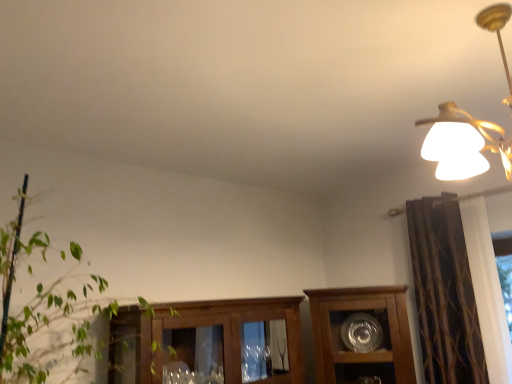
This screenshot has height=384, width=512. Find the location of `green leafy plant at left`. green leafy plant at left is located at coordinates (45, 307).

I want to click on wooden cabinet at center, so click(x=368, y=335).

What do you see at coordinates (462, 144) in the screenshot?
I see `matte gold chandelier at upper right` at bounding box center [462, 144].

Locate an element on the screen. green leafy plant at left is located at coordinates (45, 307).

Considering the relative sizes of wooden cabinet at center and matte gold chandelier at upper right in the image provided, is wooden cabinet at center thinner than matte gold chandelier at upper right?

Correct, the width of wooden cabinet at center is less than that of matte gold chandelier at upper right.

From a real-world perspective, which object stands above the other?

matte gold chandelier at upper right.

How far apart are wooden cabinet at center and matte gold chandelier at upper right?

They are 1.59 meters apart.

Is wooden cabinet at center turned away from matte gold chandelier at upper right?

No, matte gold chandelier at upper right is not at the back of wooden cabinet at center.

Which point is more forward, (434, 118) or (87, 302)?

Positioned in front is point (434, 118).

Between matte gold chandelier at upper right and green leafy plant at left, which one has smaller size?

matte gold chandelier at upper right is smaller.

Considering the relative sizes of matte gold chandelier at upper right and green leafy plant at left in the image provided, is matte gold chandelier at upper right shorter than green leafy plant at left?

Yes.

In the scene shown: From a real-world perspective, is matte gold chandelier at upper right on top of green leafy plant at left?

Yes, from a real-world perspective, matte gold chandelier at upper right is on top of green leafy plant at left.

Does point (420, 332) come farther from viewer compared to point (22, 218)?

Yes.

Considering the sizes of brown textured curtain at right and green leafy plant at left in the image, is brown textured curtain at right taller or shorter than green leafy plant at left?

brown textured curtain at right is taller than green leafy plant at left.

Consider the image. From the image's perspective, relative to green leafy plant at left, is brown textured curtain at right above or below?

Clearly, from the image's perspective, brown textured curtain at right is below green leafy plant at left.

Is brown textured curtain at right looking in the opposite direction of green leafy plant at left?

No, brown textured curtain at right is not facing away from green leafy plant at left.

From the image's perspective, is green leafy plant at left located above matte gold chandelier at upper right?

No, from the image's perspective, green leafy plant at left is not on top of matte gold chandelier at upper right.

Is green leafy plant at left not near matte gold chandelier at upper right?

Absolutely, green leafy plant at left is distant from matte gold chandelier at upper right.

Between green leafy plant at left and matte gold chandelier at upper right, which one appears on the right side from the viewer's perspective?

Positioned to the right is matte gold chandelier at upper right.

Is matte gold chandelier at upper right surrounded by green leafy plant at left?

Actually, matte gold chandelier at upper right is outside green leafy plant at left.

Between point (437, 329) and point (460, 109), which one is positioned behind?

Point (437, 329)

Considering the positions of objects brown textured curtain at right and matte gold chandelier at upper right in the image provided, who is behind, brown textured curtain at right or matte gold chandelier at upper right?

brown textured curtain at right is behind.

Are matte gold chandelier at upper right and wooden cabinet at center far apart?

matte gold chandelier at upper right is positioned a significant distance from wooden cabinet at center.

At what (x,y) coordinates should I click in order to perform the action: click on lamp that appears above the wooden cabinet at center (from the image's perspective). Please return your answer as a coordinate pair (x, y). The width and height of the screenshot is (512, 384). Looking at the image, I should click on (462, 144).

Is matte gold chandelier at upper right outside of wooden cabinet at center?

Yes, matte gold chandelier at upper right is outside of wooden cabinet at center.

From a real-world perspective, is matte gold chandelier at upper right positioned above or below wooden cabinet at center?

matte gold chandelier at upper right is situated higher than wooden cabinet at center in the real world.

You are a GUI agent. You are given a task and a screenshot of the screen. Output one action in this format:
    pyautogui.click(x=<x>, y=<y>)
    Task: Click on the curtain that appears below the green leafy plant at left (from the image's perspective)
    Image resolution: width=512 pixels, height=384 pixels.
    Given the screenshot: What is the action you would take?
    pyautogui.click(x=444, y=293)

In the scene shown: From the image's perspective, which object appears higher, green leafy plant at left or brown textured curtain at right?

green leafy plant at left, from the image's perspective.

Is green leafy plant at left not near brown textured curtain at right?

Absolutely, green leafy plant at left is distant from brown textured curtain at right.

From a real-world perspective, which is physically below, green leafy plant at left or brown textured curtain at right?

In real-world perspective, brown textured curtain at right is lower.

This screenshot has height=384, width=512. I want to click on cabinetry on the left side of matte gold chandelier at upper right, so click(x=368, y=335).

Locate an element on the screen. lamp lying on the right of green leafy plant at left is located at coordinates (462, 144).

Estimate the real-world distances between objects in this image. Which object is further from green leafy plant at left, wooden cabinet at center or brown textured curtain at right?

Among the two, brown textured curtain at right is located further to green leafy plant at left.

When comparing their distances from wooden cabinet at center, does matte gold chandelier at upper right or green leafy plant at left seem further?

matte gold chandelier at upper right is positioned further to the anchor wooden cabinet at center.

Which object lies further to the anchor point green leafy plant at left, wooden cabinet at center or matte gold chandelier at upper right?

matte gold chandelier at upper right is further to green leafy plant at left.

Based on their spatial positions, is matte gold chandelier at upper right or wooden cabinet at center further from brown textured curtain at right?

matte gold chandelier at upper right is positioned further to the anchor brown textured curtain at right.

When comparing their distances from matte gold chandelier at upper right, does brown textured curtain at right or wooden cabinet at center seem closer?

brown textured curtain at right is positioned closer to the anchor matte gold chandelier at upper right.

Considering their positions, is matte gold chandelier at upper right positioned closer to green leafy plant at left than brown textured curtain at right?

matte gold chandelier at upper right.

From the image, which object appears to be nearer to brown textured curtain at right, matte gold chandelier at upper right or green leafy plant at left?

Among the two, matte gold chandelier at upper right is located nearer to brown textured curtain at right.

Looking at the image, which one is located further to brown textured curtain at right, wooden cabinet at center or green leafy plant at left?

Among the two, green leafy plant at left is located further to brown textured curtain at right.

Identify the location of lamp situated between green leafy plant at left and brown textured curtain at right from left to right. This screenshot has height=384, width=512. (462, 144).

This screenshot has height=384, width=512. I want to click on cabinetry between green leafy plant at left and matte gold chandelier at upper right in the horizontal direction, so click(x=368, y=335).

Identify the location of curtain located between matte gold chandelier at upper right and wooden cabinet at center in the depth direction. (444, 293).

This screenshot has width=512, height=384. Identify the location of cabinetry between green leafy plant at left and brown textured curtain at right in the horizontal direction. (368, 335).